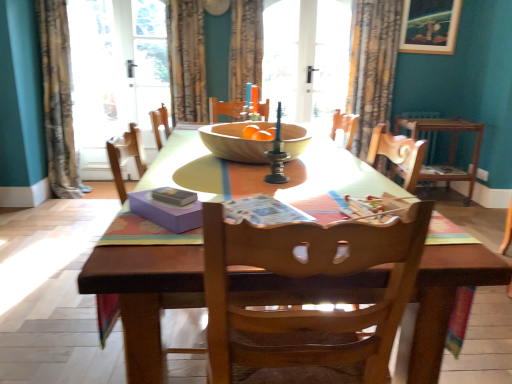
Question: Considering the relative sizes of matte purple magazine at center, the second magazine from the right, and velvet-like brown curtain at upper center, the 3th curtain in the right-to-left sequence, in the image provided, is matte purple magazine at center, the second magazine from the right, bigger than velvet-like brown curtain at upper center, the 3th curtain in the right-to-left sequence,?

Choices:
 (A) no
 (B) yes

Answer: (A)

Question: Considering the relative sizes of matte purple magazine at center, the second magazine from the right, and velvet-like brown curtain at upper center, the 3th curtain in the right-to-left sequence, in the image provided, is matte purple magazine at center, the second magazine from the right, thinner than velvet-like brown curtain at upper center, the 3th curtain in the right-to-left sequence,?

Choices:
 (A) yes
 (B) no

Answer: (A)

Question: Is matte purple magazine at center, the second magazine from the right, next to velvet-like brown curtain at upper center, the 3th curtain in the right-to-left sequence?

Choices:
 (A) yes
 (B) no

Answer: (B)

Question: Is matte purple magazine at center, acting as the 1th magazine starting from the left, facing towards velvet-like brown curtain at upper center, the 3th curtain in the right-to-left sequence?

Choices:
 (A) no
 (B) yes

Answer: (A)

Question: From a real-world perspective, is matte purple magazine at center, acting as the 1th magazine starting from the left, physically above velvet-like brown curtain at upper center, which appears as the 2th curtain when viewed from the left?

Choices:
 (A) yes
 (B) no

Answer: (B)

Question: Based on their sizes in the image, would you say wooden chair at center, acting as the 1th chair starting from the bottom, is bigger or smaller than transparent glass door at center?

Choices:
 (A) small
 (B) big

Answer: (B)

Question: Considering the relative positions of wooden chair at center, the 2th chair when ordered from back to front, and transparent glass door at center in the image provided, is wooden chair at center, the 2th chair when ordered from back to front, to the left or to the right of transparent glass door at center?

Choices:
 (A) left
 (B) right

Answer: (A)

Question: From the image's perspective, is wooden chair at center, acting as the second chair starting from the top, above or below transparent glass door at center?

Choices:
 (A) above
 (B) below

Answer: (B)

Question: From their relative heights in the image, would you say wooden chair at center, arranged as the 1th chair when viewed from the front, is taller or shorter than transparent glass door at center?

Choices:
 (A) short
 (B) tall

Answer: (A)

Question: Looking at the image, does wooden picture frame at upper right seem bigger or smaller compared to wooden chair at center, acting as the second chair starting from the right?

Choices:
 (A) big
 (B) small

Answer: (B)

Question: From the image's perspective, is wooden picture frame at upper right positioned above or below wooden chair at center, acting as the second chair starting from the right?

Choices:
 (A) below
 (B) above

Answer: (B)

Question: Does point (449, 34) appear closer or farther from the camera than point (393, 309)?

Choices:
 (A) closer
 (B) farther

Answer: (B)

Question: Would you say wooden picture frame at upper right is inside or outside wooden chair at center, the 2th chair when ordered from back to front?

Choices:
 (A) outside
 (B) inside

Answer: (A)

Question: Considering the positions of point (64, 39) and point (240, 125), is point (64, 39) closer or farther from the camera than point (240, 125)?

Choices:
 (A) closer
 (B) farther

Answer: (B)

Question: Is patterned fabric curtain at left, which appears as the 1th curtain when viewed from the left, bigger or smaller than wooden bowl at center?

Choices:
 (A) big
 (B) small

Answer: (A)